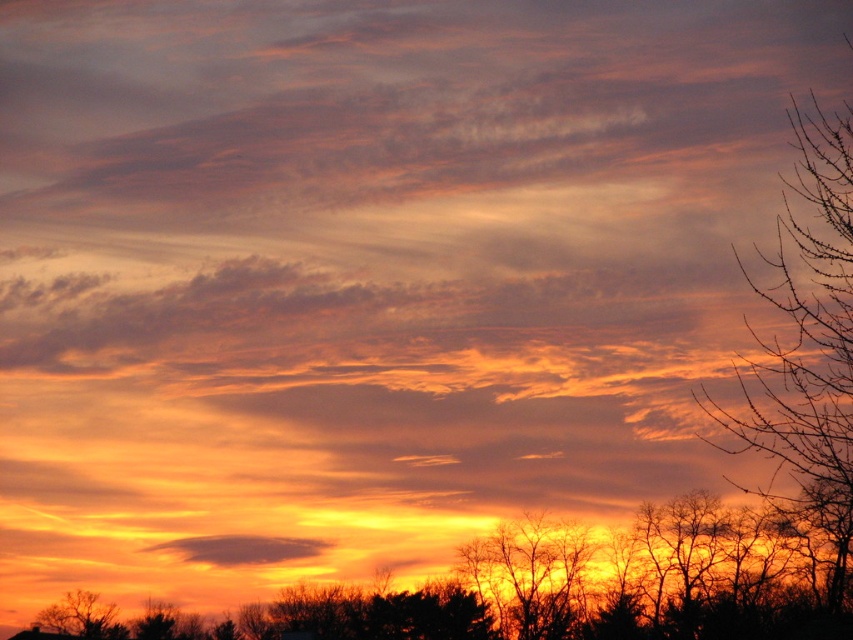
Question: Considering the real-world distances, which object is farthest from the silhouette bare tree at lower left?

Choices:
 (A) bare branches at right
 (B) silhouette bare tree at bottom
 (C) translucent orange cloud at center

Answer: (A)

Question: Is translucent orange cloud at center below silhouette bare tree at lower left?

Choices:
 (A) no
 (B) yes

Answer: (A)

Question: Which point is farther to the camera?

Choices:
 (A) silhouette bare tree at bottom
 (B) bare branches at right

Answer: (A)

Question: Estimate the real-world distances between objects in this image. Which object is farther from the translucent orange cloud at center?

Choices:
 (A) silhouette bare tree at bottom
 (B) silhouette bare tree at lower left

Answer: (A)

Question: Does silhouette bare tree at bottom have a smaller size compared to silhouette bare tree at lower left?

Choices:
 (A) yes
 (B) no

Answer: (B)

Question: Does silhouette bare tree at bottom lie in front of bare branches at right?

Choices:
 (A) yes
 (B) no

Answer: (B)